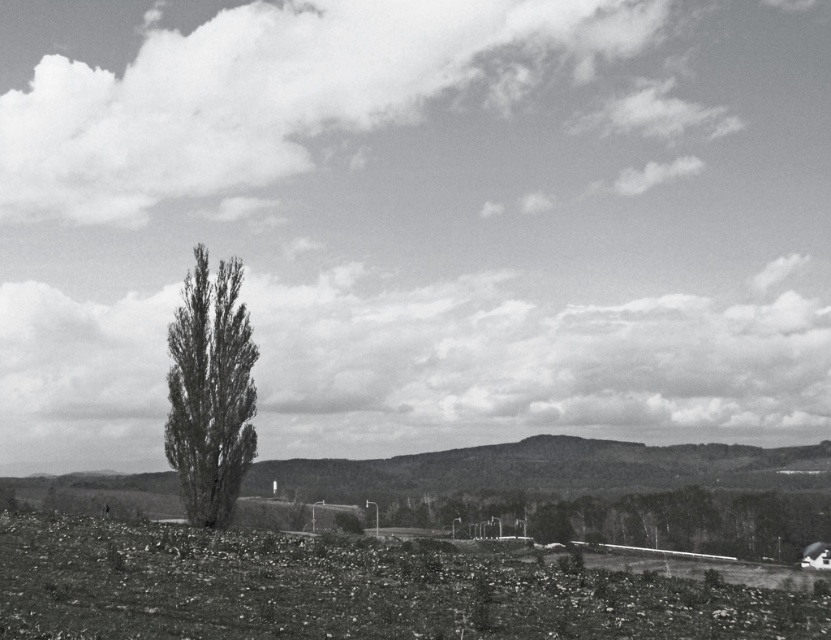
Question: Is gravelly soil at lower center in front of smooth green tree at center?

Choices:
 (A) yes
 (B) no

Answer: (A)

Question: Considering the real-world distances, which object is farthest from the gravelly soil at lower center?

Choices:
 (A) gray textured tree at center
 (B) smooth green tree at center

Answer: (B)

Question: Among these objects, which one is nearest to the camera?

Choices:
 (A) smooth green tree at center
 (B) gravelly soil at lower center

Answer: (B)

Question: Does smooth green tree at center appear on the left side of gray textured tree at center?

Choices:
 (A) yes
 (B) no

Answer: (B)

Question: Is gravelly soil at lower center bigger than smooth green tree at center?

Choices:
 (A) yes
 (B) no

Answer: (B)

Question: Considering the real-world distances, which object is closest to the gray textured tree at center?

Choices:
 (A) gravelly soil at lower center
 (B) smooth green tree at center

Answer: (A)